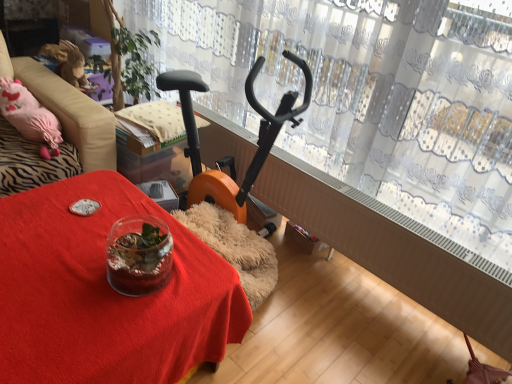
Question: Based on their sizes in the image, would you say transparent lace curtain at upper center is bigger or smaller than translucent glass terrarium at center?

Choices:
 (A) small
 (B) big

Answer: (B)

Question: From a real-world perspective, is transparent lace curtain at upper center physically located above or below translucent glass terrarium at center?

Choices:
 (A) below
 (B) above

Answer: (B)

Question: Estimate the real-world distances between objects in this image. Which object is closer to the translucent glass terrarium at center?

Choices:
 (A) transparent lace curtain at upper center
 (B) velvet pink cushion at left

Answer: (B)

Question: Estimate the real-world distances between objects in this image. Which object is closer to the translucent glass terrarium at center?

Choices:
 (A) transparent lace curtain at upper center
 (B) velvet pink cushion at left

Answer: (B)